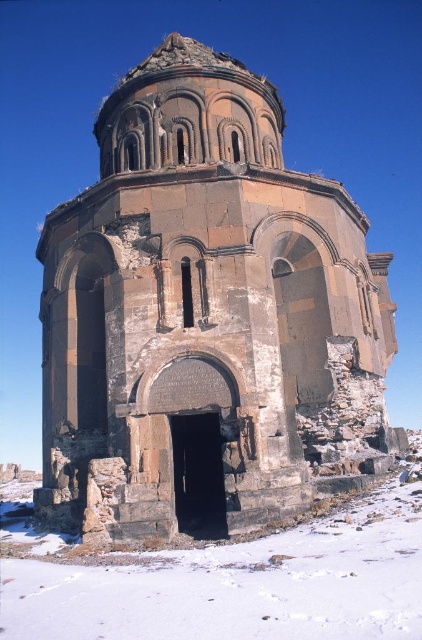
In the scene shown: Which is more to the right, stone church at center or white powdery snow at lower center?

stone church at center is more to the right.

Does stone church at center appear on the right side of white powdery snow at lower center?

Yes, stone church at center is to the right of white powdery snow at lower center.

The height and width of the screenshot is (640, 422). In order to click on stone church at center in this screenshot , I will do `click(205, 317)`.

Where is `stone church at center`? Image resolution: width=422 pixels, height=640 pixels. stone church at center is located at coordinates tap(205, 317).